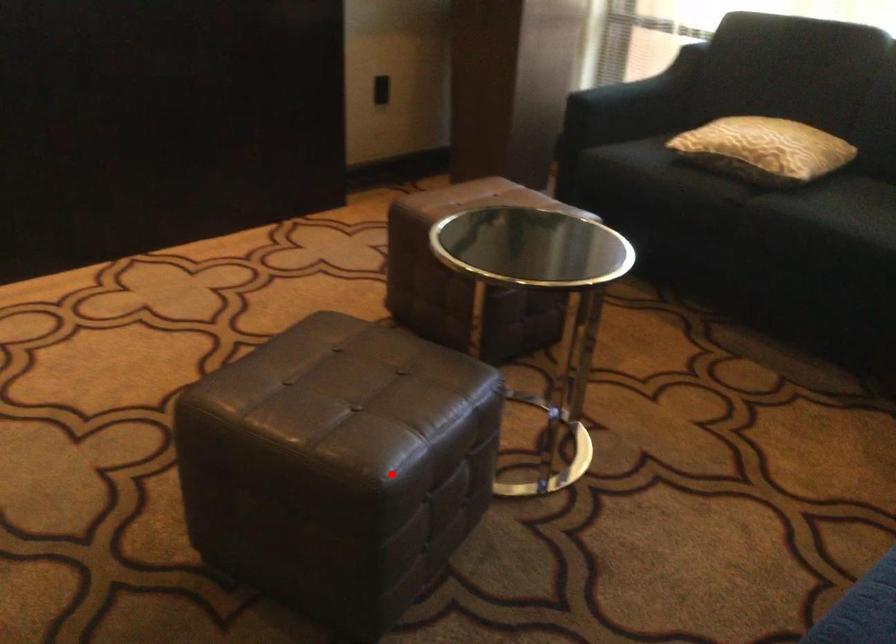
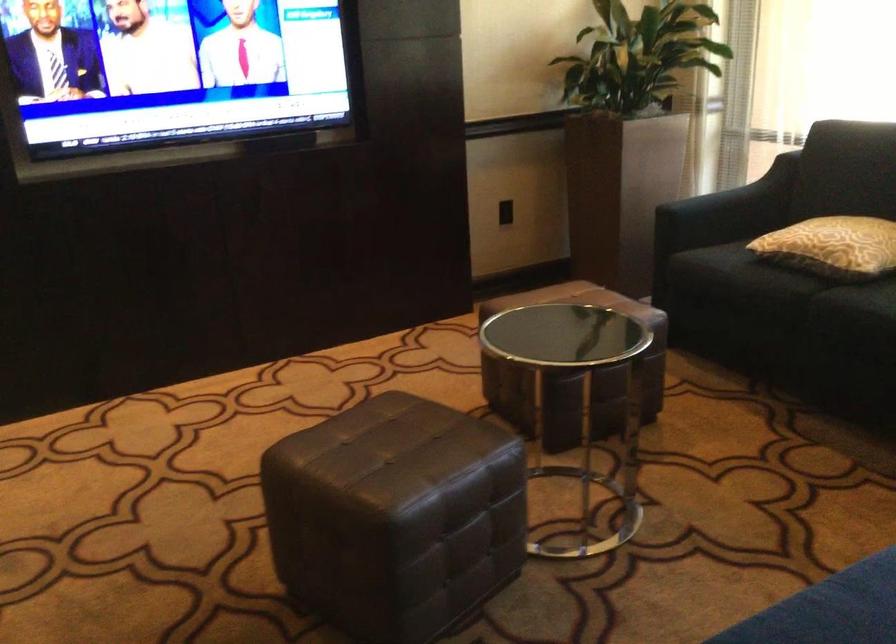
Question: A red point is marked in image1. In image2, is the corresponding 3D point closer to the camera or farther? Reply with the corresponding letter.

Choices:
 (A) The corresponding 3D point is closer.
 (B) The corresponding 3D point is farther.

Answer: (B)